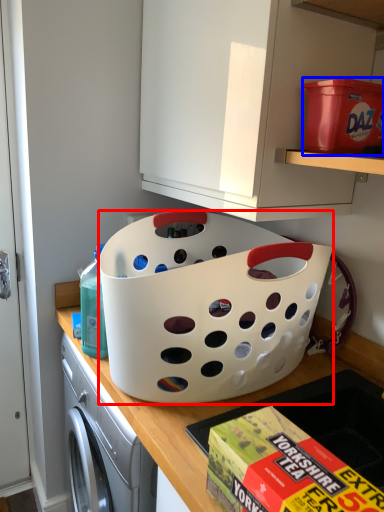
Question: Which point is further to the camera, basket (highlighted by a red box) or storage box (highlighted by a blue box)?

Choices:
 (A) basket
 (B) storage box

Answer: (A)